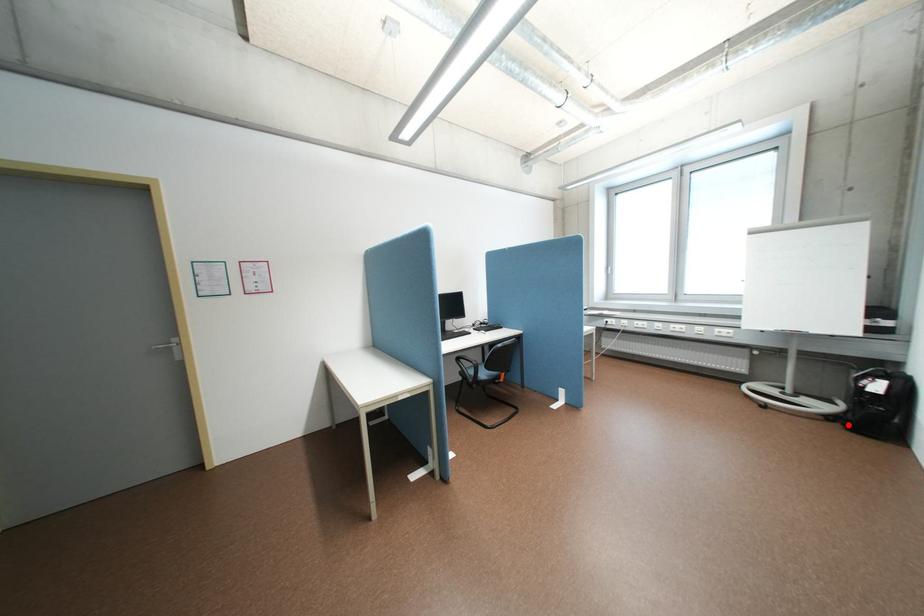
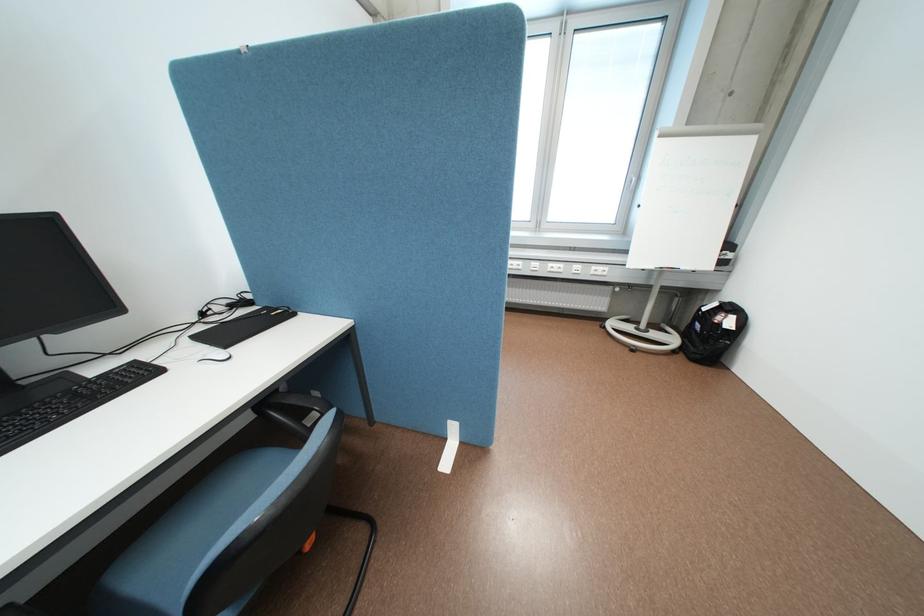
Where in the second image is the point corresponding to the highlighted location from the first image?

(691, 357)